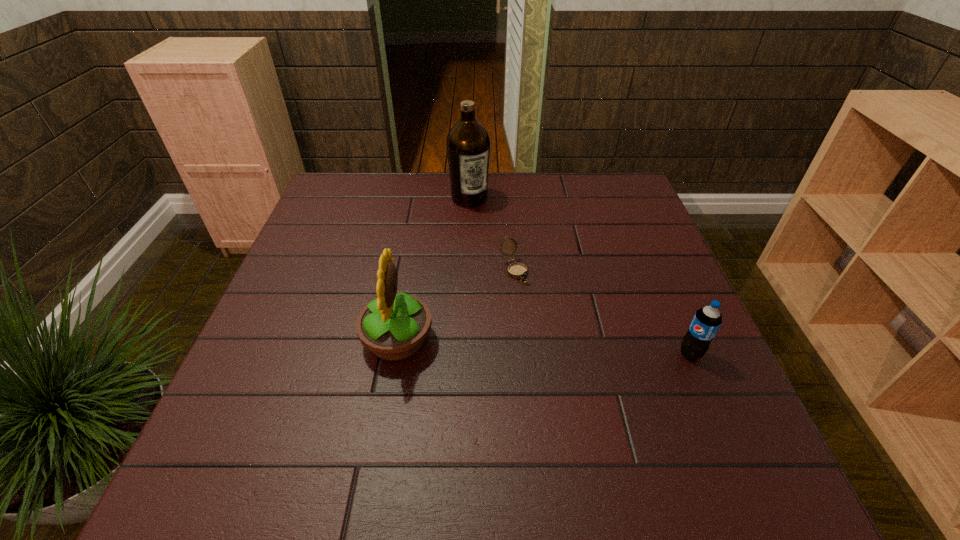
Where is `empty location between the olive oil and the second tallest object`? Image resolution: width=960 pixels, height=540 pixels. empty location between the olive oil and the second tallest object is located at coordinates (433, 269).

The image size is (960, 540). I want to click on vacant area between the rightmost object and the second object from left to right, so click(580, 276).

You are a GUI agent. You are given a task and a screenshot of the screen. Output one action in this format:
    pyautogui.click(x=<x>, y=<y>)
    Task: Click on the free area in between the shortest object and the olive oil
    The image size is (960, 540).
    Given the screenshot: What is the action you would take?
    pyautogui.click(x=492, y=234)

Point out which object is positioned as the second nearest to the leftmost object. Please provide its 2D coordinates. Your answer should be formatted as a tuple, i.e. [(x, y)], where the tuple contains the x and y coordinates of a point satisfying the conditions above.

[(468, 143)]

Locate which object ranks second in proximity to the soda bottle. Please provide its 2D coordinates. Your answer should be formatted as a tuple, i.e. [(x, y)], where the tuple contains the x and y coordinates of a point satisfying the conditions above.

[(394, 326)]

What are the coordinates of `vacant point that satisfies the following two spatial constraints: 1. on the front side of the tallest object; 2. on the right side of the shortest object` in the screenshot? It's located at (467, 270).

Find the location of a particular element. The height and width of the screenshot is (540, 960). free space that satisfies the following two spatial constraints: 1. on the front side of the olive oil; 2. on the right side of the soda bottle is located at coordinates tap(465, 354).